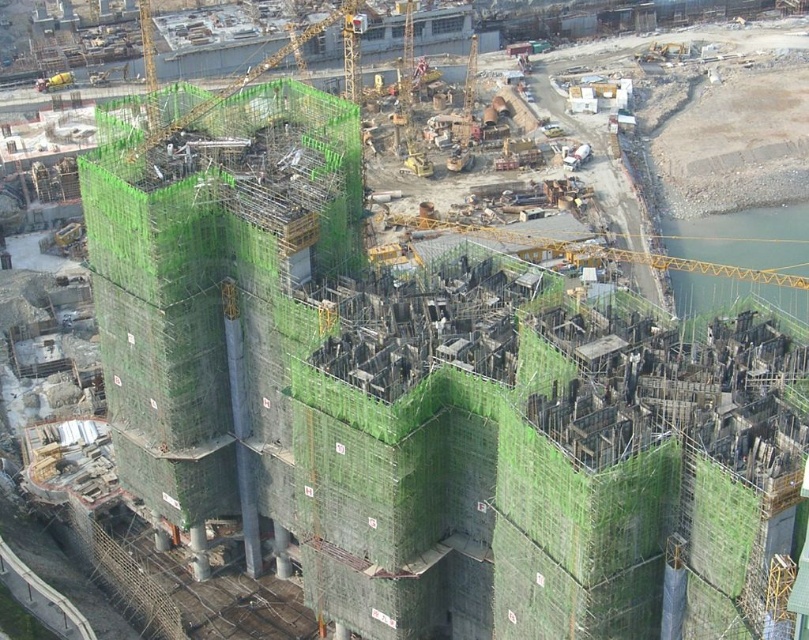
Who is taller, yellow metal crane at upper right or green mesh scaffolding at upper center?

green mesh scaffolding at upper center is taller.

Does yellow metal crane at upper right appear over green mesh scaffolding at upper center?

Incorrect, yellow metal crane at upper right is not positioned above green mesh scaffolding at upper center.

Describe the element at coordinates (591, 250) in the screenshot. The width and height of the screenshot is (809, 640). I see `yellow metal crane at upper right` at that location.

Identify the location of yellow metal crane at upper right. The image size is (809, 640). (591, 250).

Is green netting at center above yellow metal crane at upper right?

No.

Is point (332, 172) positioned after point (469, 236)?

No, (332, 172) is in front of (469, 236).

Where is `green netting at center`? This screenshot has width=809, height=640. green netting at center is located at coordinates [x=217, y=292].

Find the location of a particular element. The image size is (809, 640). green netting at center is located at coordinates (217, 292).

Identify the location of green netting at center. Image resolution: width=809 pixels, height=640 pixels. (217, 292).

Image resolution: width=809 pixels, height=640 pixels. I want to click on green netting at center, so click(x=217, y=292).

Identify the location of green netting at center. (217, 292).